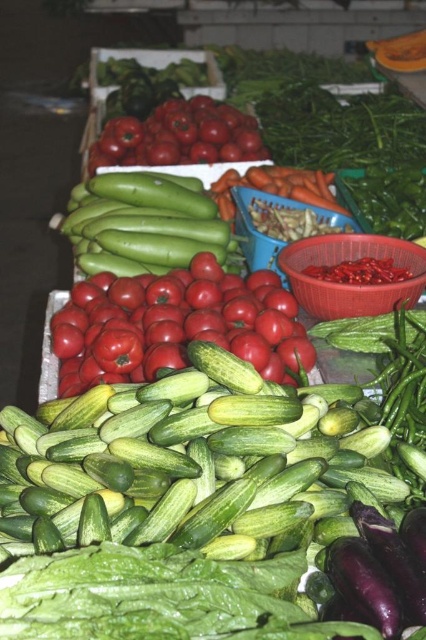
Who is positioned more to the right, green smooth cucumber at center or purple matte eggplant at lower right?

purple matte eggplant at lower right is more to the right.

Does point (91, 460) come in front of point (347, 570)?

No, (91, 460) is further to viewer.

The image size is (426, 640). I want to click on green smooth cucumber at center, so click(x=189, y=456).

Is shiny red tomatoes at upper center below purple matte eggplant at lower right?

No.

Image resolution: width=426 pixels, height=640 pixels. I want to click on shiny red tomatoes at upper center, so click(x=180, y=136).

Is shiny red tomatoes at upper center taller than orange smooth carrot at center?

Yes.

Does shiny red tomatoes at upper center have a lesser height compared to orange smooth carrot at center?

No, shiny red tomatoes at upper center is not shorter than orange smooth carrot at center.

Who is more forward, (x=218, y=148) or (x=287, y=189)?

Point (x=287, y=189) is more forward.

At what (x,y) coordinates should I click in order to perform the action: click on shiny red tomatoes at upper center. Please return your answer as a coordinate pair (x, y). The image size is (426, 640). Looking at the image, I should click on (180, 136).